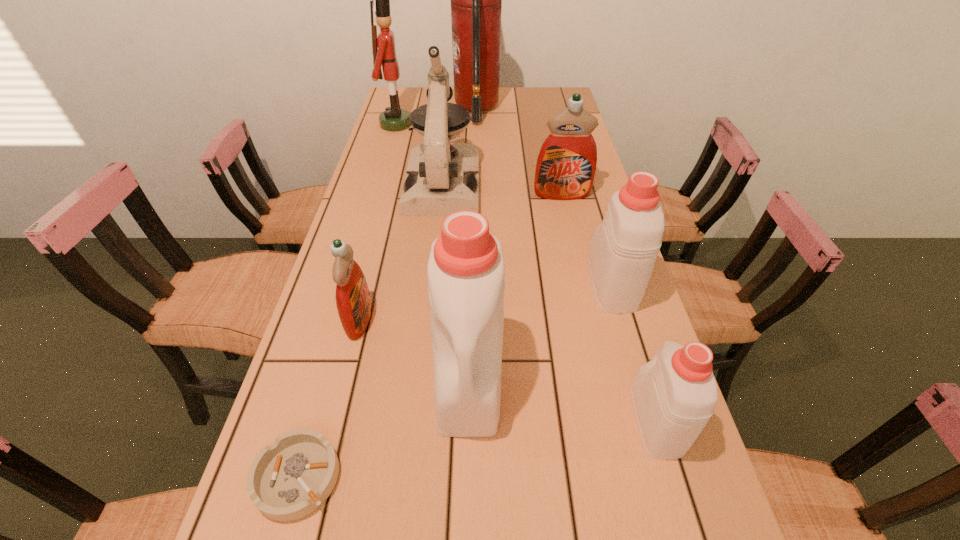
Select which detergent appears as the closest to the smallest white detergent. Please provide its 2D coordinates. Your answer should be formatted as a tuple, i.e. [(x, y)], where the tuple contains the x and y coordinates of a point satisfying the conditions above.

[(622, 254)]

Identify the location of white detergent that is the third closest to the microscope. (674, 395).

Locate which white detergent ranks third in proximity to the nearer red detergent. Please provide its 2D coordinates. Your answer should be formatted as a tuple, i.e. [(x, y)], where the tuple contains the x and y coordinates of a point satisfying the conditions above.

[(674, 395)]

The height and width of the screenshot is (540, 960). Identify the location of free region that satisfies the following two spatial constraints: 1. on the front surface of the leftmost detergent; 2. on the front side of the ashtray. click(320, 477).

This screenshot has width=960, height=540. Identify the location of free space that satisfies the following two spatial constraints: 1. on the front surface of the nearer red detergent; 2. on the handle side of the smallest white detergent. click(x=334, y=420).

Image resolution: width=960 pixels, height=540 pixels. I want to click on free space that satisfies the following two spatial constraints: 1. on the handle side of the smallest white detergent; 2. at the front of the fire extinguisher where the nozzle is aimed, so click(x=562, y=109).